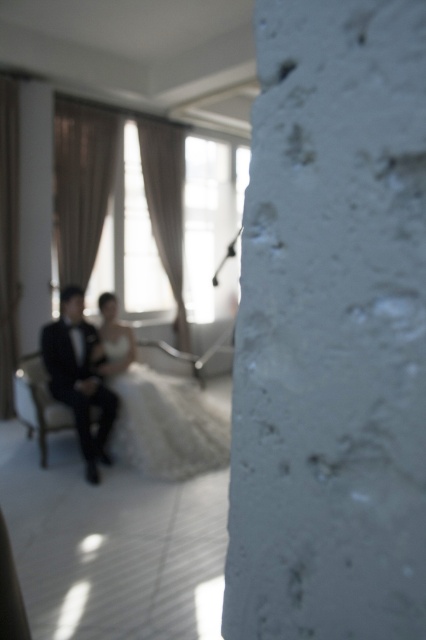
Where is `white satin dress at center`? white satin dress at center is located at coordinates tap(157, 410).

Find the location of a particular element. white satin dress at center is located at coordinates (157, 410).

Find the location of a particular element. white satin dress at center is located at coordinates (157, 410).